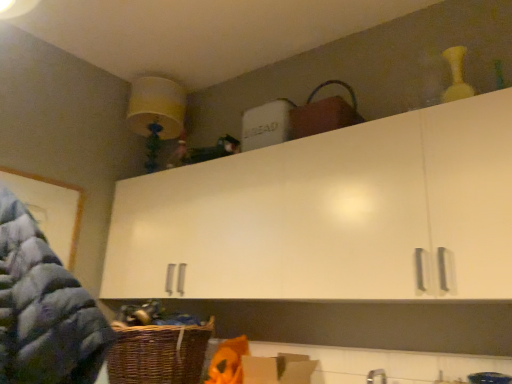
The image size is (512, 384). Describe the element at coordinates (158, 353) in the screenshot. I see `woven brown basket at lower left` at that location.

The width and height of the screenshot is (512, 384). I want to click on woven brown basket at lower left, so click(x=158, y=353).

Where is `woven brown basket at lower left`? woven brown basket at lower left is located at coordinates [158, 353].